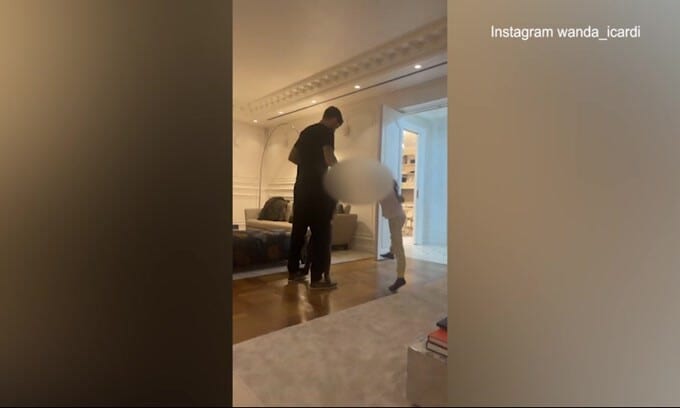
The height and width of the screenshot is (408, 680). Find the location of `ceiling`. ceiling is located at coordinates (305, 45).